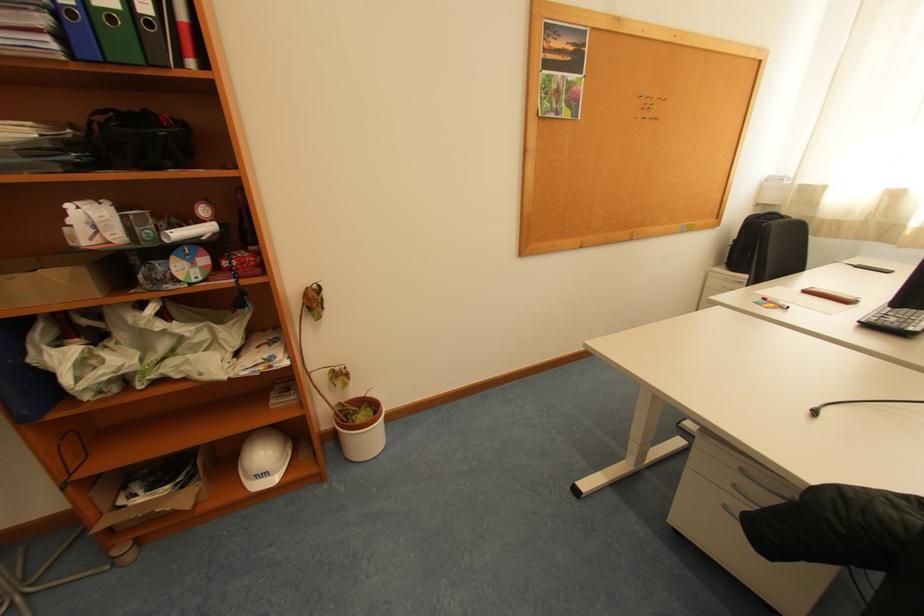
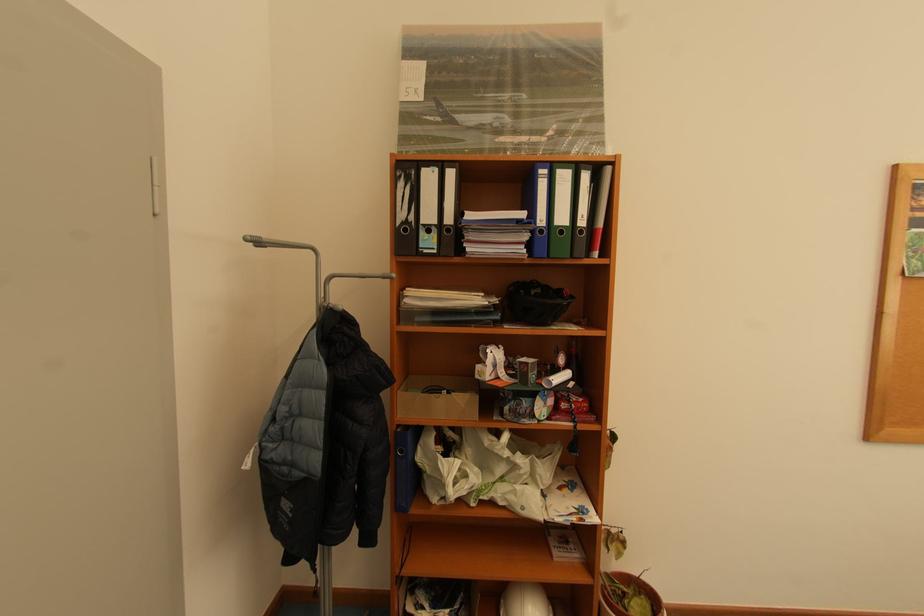
Locate, in the second image, the point that corresponds to (x=123, y=111) in the first image.

(526, 284)